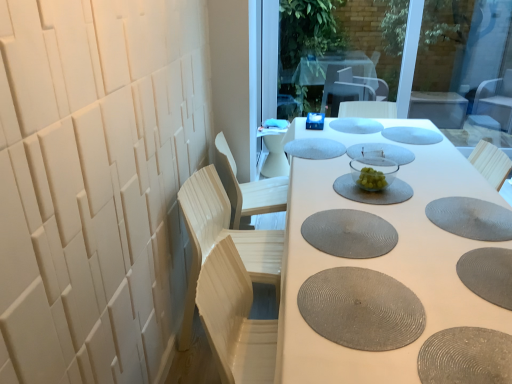
What are the coordinates of `free spot to the right of clear glass bowl at center, which is the fourth manhole cover in back-to-front order` in the screenshot? It's located at (433, 157).